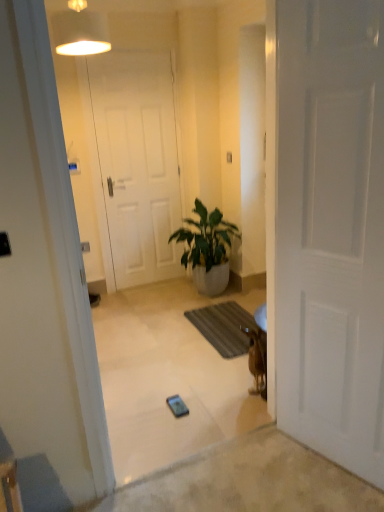
Question: Is white fabric lampshade at upper center wider than brown furry dog at right?

Choices:
 (A) no
 (B) yes

Answer: (B)

Question: Does white fabric lampshade at upper center come behind brown furry dog at right?

Choices:
 (A) no
 (B) yes

Answer: (A)

Question: Can you confirm if white fabric lampshade at upper center is positioned to the right of brown furry dog at right?

Choices:
 (A) no
 (B) yes

Answer: (A)

Question: Considering the relative sizes of white fabric lampshade at upper center and brown furry dog at right in the image provided, is white fabric lampshade at upper center smaller than brown furry dog at right?

Choices:
 (A) no
 (B) yes

Answer: (A)

Question: From the image's perspective, would you say white fabric lampshade at upper center is positioned over brown furry dog at right?

Choices:
 (A) yes
 (B) no

Answer: (A)

Question: Is metallic silver phone at center bigger or smaller than brown textured mat at lower center?

Choices:
 (A) small
 (B) big

Answer: (A)

Question: Visually, is metallic silver phone at center positioned to the left or to the right of brown textured mat at lower center?

Choices:
 (A) right
 (B) left

Answer: (B)

Question: Looking at their shapes, would you say metallic silver phone at center is wider or thinner than brown textured mat at lower center?

Choices:
 (A) thin
 (B) wide

Answer: (A)

Question: Is metallic silver phone at center spatially inside brown textured mat at lower center, or outside of it?

Choices:
 (A) inside
 (B) outside

Answer: (B)

Question: Is point (170, 400) closer or farther from the camera than point (190, 229)?

Choices:
 (A) farther
 (B) closer

Answer: (B)

Question: In terms of width, does metallic silver phone at center look wider or thinner when compared to green glossy plant at center?

Choices:
 (A) wide
 (B) thin

Answer: (B)

Question: From the image's perspective, is metallic silver phone at center above or below green glossy plant at center?

Choices:
 (A) below
 (B) above

Answer: (A)

Question: Looking at the image, does metallic silver phone at center seem bigger or smaller compared to green glossy plant at center?

Choices:
 (A) small
 (B) big

Answer: (A)

Question: In terms of size, does green glossy plant at center appear bigger or smaller than metallic silver phone at center?

Choices:
 (A) big
 (B) small

Answer: (A)

Question: Considering the relative positions of green glossy plant at center and metallic silver phone at center in the image provided, is green glossy plant at center to the left or to the right of metallic silver phone at center?

Choices:
 (A) left
 (B) right

Answer: (B)